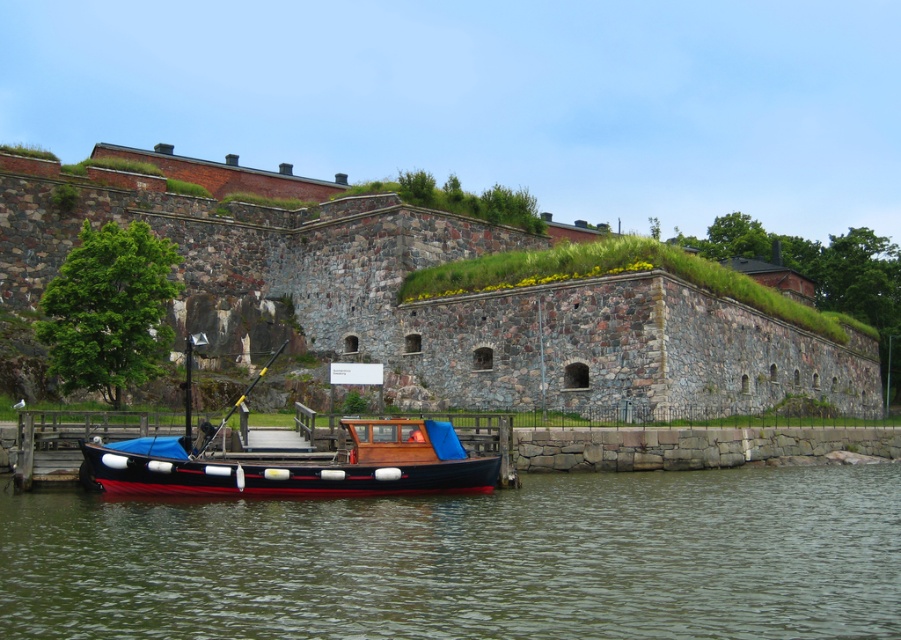
Is stone wall at center shorter than wooden boat at lower left?

No, stone wall at center is not shorter than wooden boat at lower left.

Does point (202, 172) lie behind point (319, 476)?

Yes, it is.

Locate an element on the screen. The width and height of the screenshot is (901, 640). stone wall at center is located at coordinates click(438, 301).

Can you confirm if greenish water at lower center is thinner than wooden boat at lower left?

No.

Does greenish water at lower center have a larger size compared to wooden boat at lower left?

No.

What do you see at coordinates (469, 561) in the screenshot?
I see `greenish water at lower center` at bounding box center [469, 561].

The height and width of the screenshot is (640, 901). Find the location of `greenish water at lower center`. greenish water at lower center is located at coordinates (469, 561).

Is greenish water at lower center below stone wall at center?

Indeed, greenish water at lower center is positioned under stone wall at center.

Between point (872, 500) and point (308, 211), which one is positioned in front?

Positioned in front is point (872, 500).

Is point (85, 636) positioned after point (695, 333)?

No.

At what (x,y) coordinates should I click in order to perform the action: click on greenish water at lower center. Please return your answer as a coordinate pair (x, y). This screenshot has height=640, width=901. Looking at the image, I should click on (469, 561).